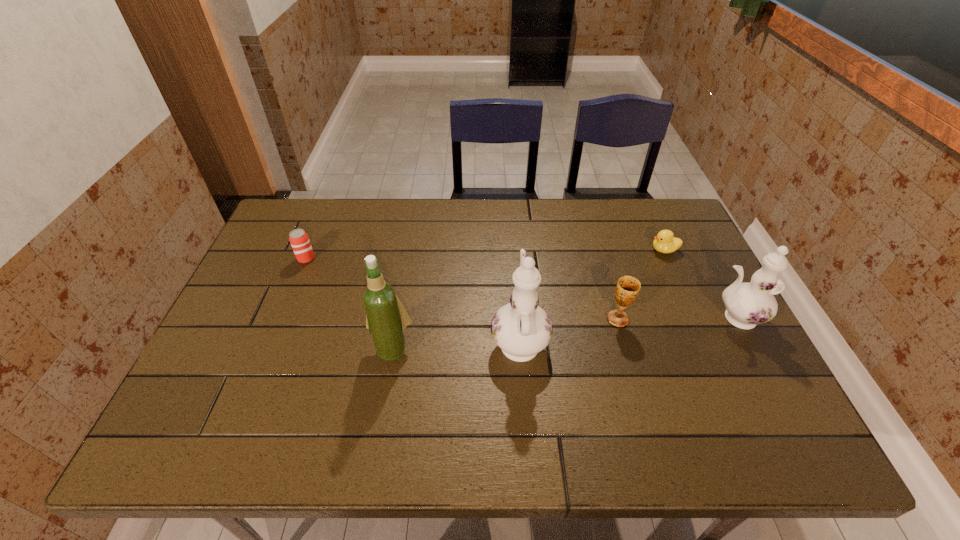
Observe the arrangement of all chinawares in the image. To keep them evenly spaced, where would you place another chinaware on the left? Please locate a free space. Please provide its 2D coordinates. Your answer should be formatted as a tuple, i.e. [(x, y)], where the tuple contains the x and y coordinates of a point satisfying the conditions above.

[(283, 364)]